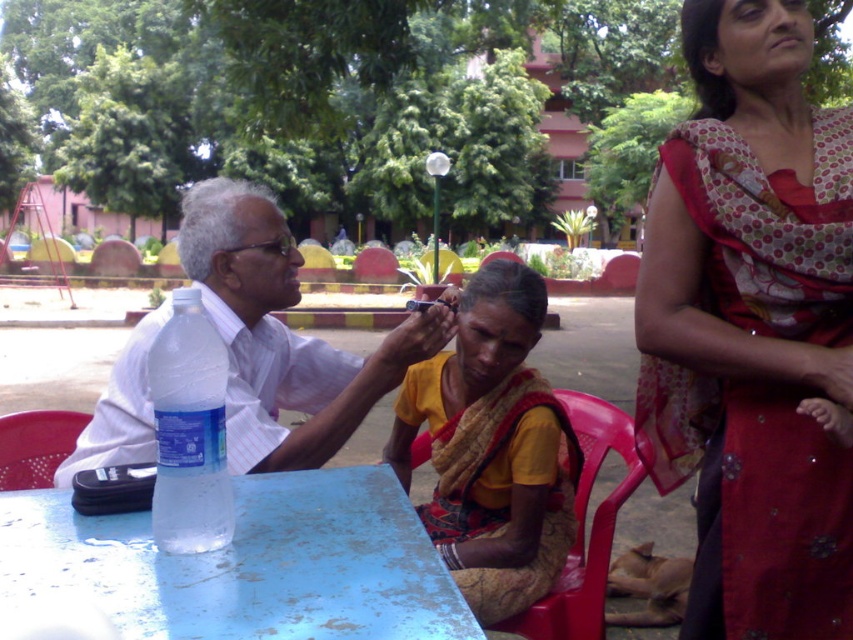
You are a service robot with a 30 inch wide tray. You need to move the blue painted wood table at lower left to the plastic chair at lower left. Can your tray fit between them?

The distance between the blue painted wood table at lower left and the plastic chair at lower left is 32.60 inches. Since your tray is 30 inches wide, it can fit between them as the space is wider than the tray.